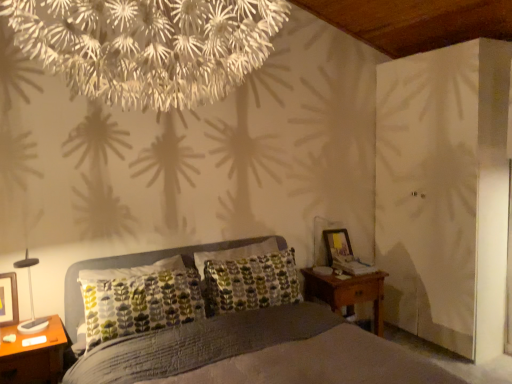
Question: Considering the relative positions of wooden nightstand at lower left, positioned as the 2th nightstand in back-to-front order, and white textured chandelier at upper center in the image provided, is wooden nightstand at lower left, positioned as the 2th nightstand in back-to-front order, to the left or to the right of white textured chandelier at upper center?

Choices:
 (A) right
 (B) left

Answer: (B)

Question: Is point (8, 377) closer or farther from the camera than point (143, 43)?

Choices:
 (A) closer
 (B) farther

Answer: (B)

Question: Which object is positioned closest to the wooden nightstand at right, which is the second nightstand from front to back?

Choices:
 (A) matte black lamp at left
 (B) wooden nightstand at lower left, the second nightstand in the right-to-left sequence
 (C) wooden picture frame at right, which ranks as the second picture frame in left-to-right order
 (D) matte black picture frame at left, which is the second picture frame from back to front
 (E) white textured chandelier at upper center

Answer: (C)

Question: Which is farther from the matte black picture frame at left, which is counted as the 1th picture frame, starting from the front?

Choices:
 (A) wooden nightstand at lower left, which is the 1th nightstand in left-to-right order
 (B) textured gray bed at center
 (C) white textured chandelier at upper center
 (D) wooden nightstand at right, acting as the first nightstand starting from the right
 (E) wooden picture frame at right, the first picture frame viewed from the right

Answer: (E)